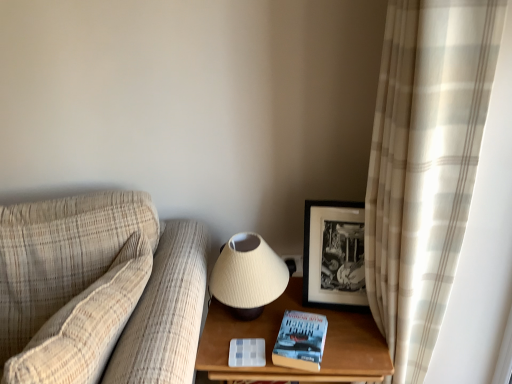
This screenshot has height=384, width=512. I want to click on vacant space that is in between black matte picture frame at upper right and hardcover blue book at lower right, so click(340, 329).